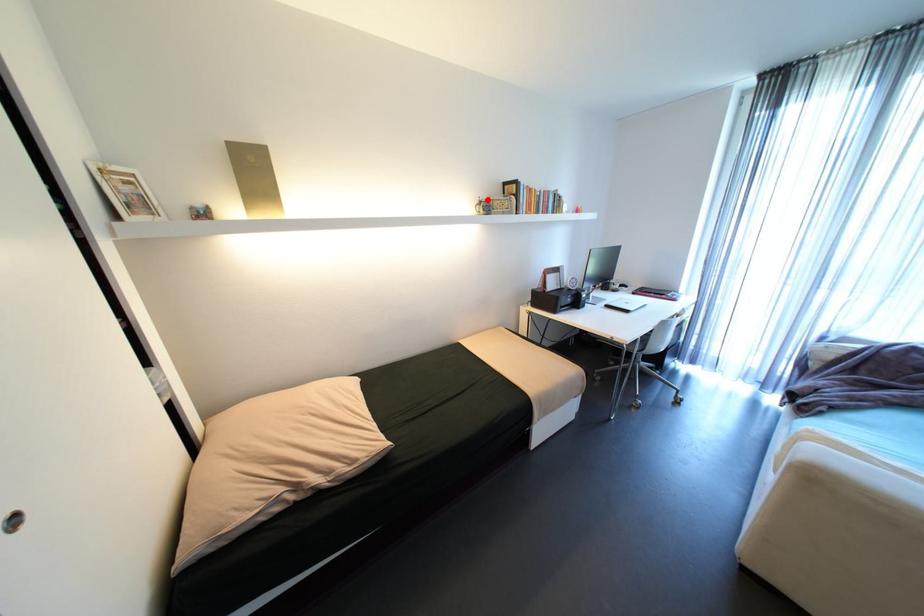
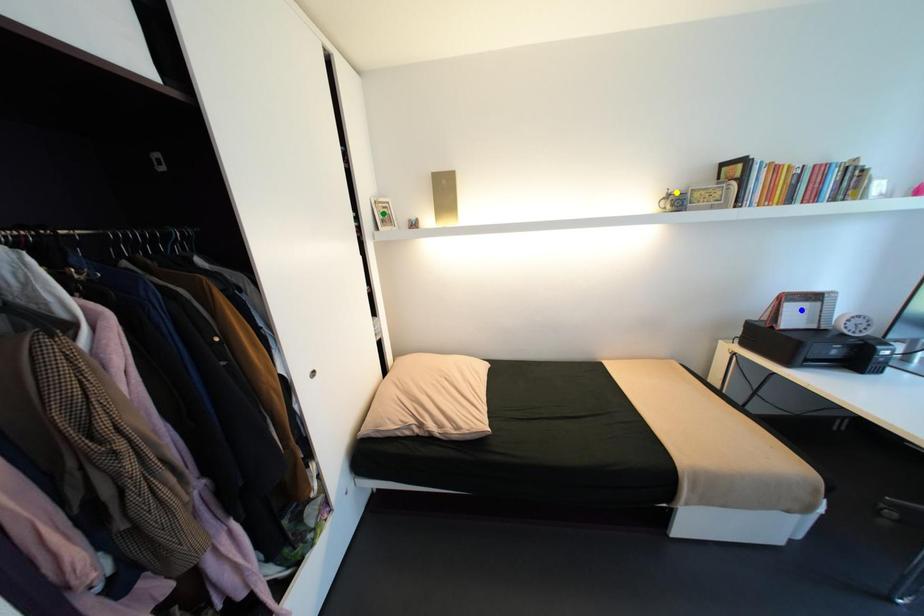
Question: I am providing you with two images of the same scene from different viewpoints. A red point is marked on the first image. You are given multiple points on the second image. Can you choose the point in image 2 that corresponds to the point in image 1?

Choices:
 (A) green point
 (B) blue point
 (C) yellow point

Answer: (C)